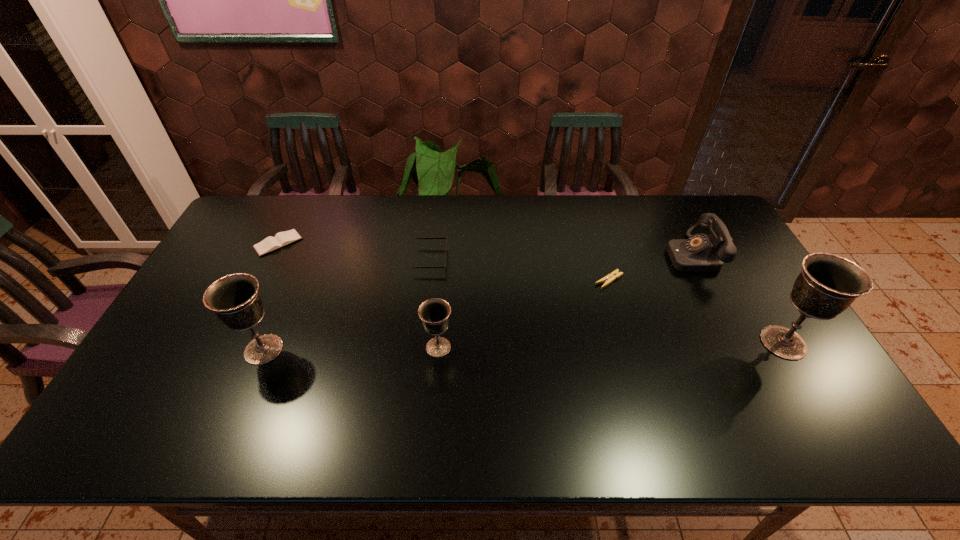
Where is `the leftmost chalice`? The width and height of the screenshot is (960, 540). the leftmost chalice is located at coordinates (235, 299).

What are the coordinates of `the second shortest chalice` in the screenshot? It's located at (235, 299).

Find the location of `the second chalice from right to left`. the second chalice from right to left is located at coordinates (434, 312).

Identify the location of the rightmost chalice. (x=828, y=284).

This screenshot has width=960, height=540. I want to click on sunglasses, so click(446, 236).

Find the location of `the third object from right to left`. the third object from right to left is located at coordinates pyautogui.click(x=609, y=278).

The image size is (960, 540). I want to click on clothespin, so click(x=609, y=278).

You are a GUI agent. You are given a task and a screenshot of the screen. Output one action in this format:
    pyautogui.click(x=<x>, y=<y>)
    Task: Click on the sixth tallest object
    
    Given the screenshot: What is the action you would take?
    pyautogui.click(x=281, y=239)

The height and width of the screenshot is (540, 960). What are the coordinates of `telephone` in the screenshot? It's located at (699, 253).

Identify the location of free space located on the right of the second tallest object. (399, 349).